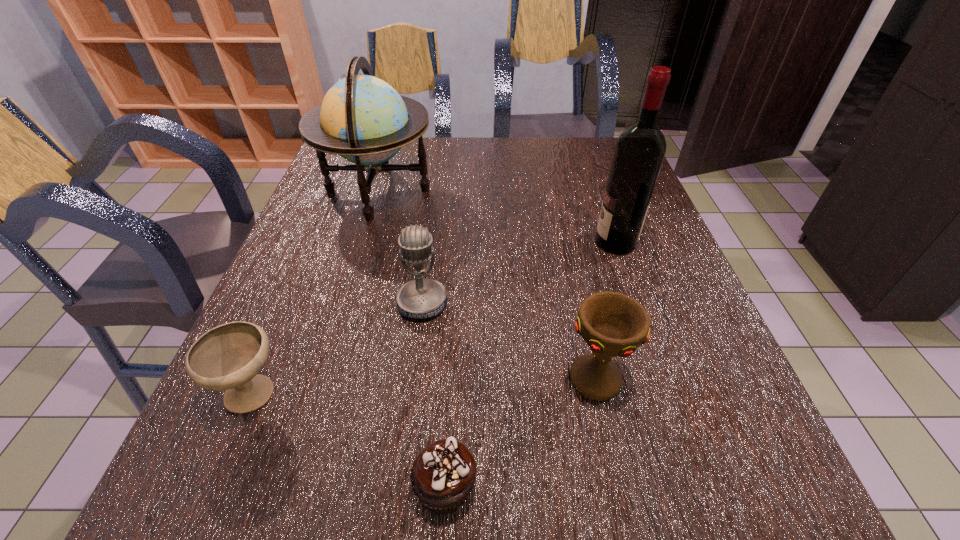
Image resolution: width=960 pixels, height=540 pixels. Identify the location of alcohol. (639, 152).

Where is `the rightmost object`? The height and width of the screenshot is (540, 960). the rightmost object is located at coordinates (639, 152).

The height and width of the screenshot is (540, 960). Find the location of `the farthest object`. the farthest object is located at coordinates (362, 118).

Where is `the fifth shortest object`? This screenshot has height=540, width=960. the fifth shortest object is located at coordinates (362, 118).

The height and width of the screenshot is (540, 960). In order to click on the third farthest object in this screenshot , I will do `click(421, 298)`.

The width and height of the screenshot is (960, 540). In order to click on microphone in this screenshot , I will do `click(421, 298)`.

Identify the location of the fifth object from left to right. This screenshot has height=540, width=960. (613, 324).

You are a GUI agent. You are given a task and a screenshot of the screen. Output one action in this format:
    pyautogui.click(x=<x>, y=<y>)
    Task: Click on the right chalice
    
    Given the screenshot: What is the action you would take?
    pyautogui.click(x=613, y=324)

Locate an element on the screen. The height and width of the screenshot is (540, 960). the shorter chalice is located at coordinates (228, 357).

In order to click on the left chalice in this screenshot , I will do `click(228, 357)`.